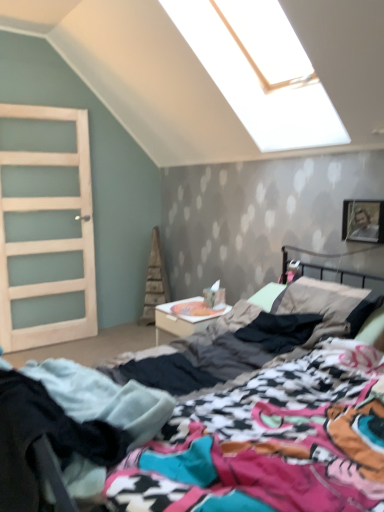
Question: Should I look upward or downward to see multicolored fabric bed at center?

Choices:
 (A) down
 (B) up

Answer: (A)

Question: Could you tell me if black cotton pants at lower left is turned towards clear glass door at left?

Choices:
 (A) no
 (B) yes

Answer: (A)

Question: From a real-world perspective, is black cotton pants at lower left physically below clear glass door at left?

Choices:
 (A) no
 (B) yes

Answer: (B)

Question: Is black cotton pants at lower left not within clear glass door at left?

Choices:
 (A) yes
 (B) no

Answer: (A)

Question: Is there a large distance between black cotton pants at lower left and clear glass door at left?

Choices:
 (A) no
 (B) yes

Answer: (B)

Question: Is black cotton pants at lower left to the right of clear glass door at left from the viewer's perspective?

Choices:
 (A) no
 (B) yes

Answer: (B)

Question: From the image's perspective, is black cotton pants at lower left located above clear glass door at left?

Choices:
 (A) yes
 (B) no

Answer: (B)

Question: From the image's perspective, is multicolored fabric bed at center under metallic silver picture frame at upper right?

Choices:
 (A) yes
 (B) no

Answer: (A)

Question: Considering the relative sizes of multicolored fabric bed at center and metallic silver picture frame at upper right in the image provided, is multicolored fabric bed at center taller than metallic silver picture frame at upper right?

Choices:
 (A) no
 (B) yes

Answer: (B)

Question: Does multicolored fabric bed at center come behind metallic silver picture frame at upper right?

Choices:
 (A) yes
 (B) no

Answer: (B)

Question: Is multicolored fabric bed at center at the left side of metallic silver picture frame at upper right?

Choices:
 (A) yes
 (B) no

Answer: (A)

Question: From a real-world perspective, is multicolored fabric bed at center under metallic silver picture frame at upper right?

Choices:
 (A) yes
 (B) no

Answer: (A)

Question: Is the position of multicolored fabric bed at center less distant than that of metallic silver picture frame at upper right?

Choices:
 (A) no
 (B) yes

Answer: (B)

Question: Considering the relative sizes of white glossy nightstand at center and clear glass door at left in the image provided, is white glossy nightstand at center shorter than clear glass door at left?

Choices:
 (A) no
 (B) yes

Answer: (B)